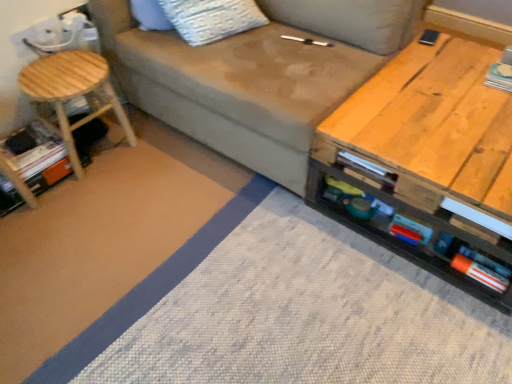
Question: Considering the relative sizes of wooden table at right and white paper book at upper right, which is counted as the 1th book, starting from the right, in the image provided, is wooden table at right thinner than white paper book at upper right, which is counted as the 1th book, starting from the right,?

Choices:
 (A) no
 (B) yes

Answer: (A)

Question: Is wooden table at right wider than white paper book at upper right, acting as the 1th book starting from the top?

Choices:
 (A) yes
 (B) no

Answer: (A)

Question: Is wooden table at right far away from white paper book at upper right, acting as the 1th book starting from the top?

Choices:
 (A) yes
 (B) no

Answer: (B)

Question: Are wooden table at right and white paper book at upper right, positioned as the 2th book in bottom-to-top order, beside each other?

Choices:
 (A) yes
 (B) no

Answer: (B)

Question: Considering the relative positions of wooden table at right and white paper book at upper right, which is counted as the 1th book, starting from the right, in the image provided, is wooden table at right to the right of white paper book at upper right, which is counted as the 1th book, starting from the right, from the viewer's perspective?

Choices:
 (A) yes
 (B) no

Answer: (B)

Question: In terms of width, does natural wood stool at left look wider or thinner when compared to wooden table at right?

Choices:
 (A) thin
 (B) wide

Answer: (A)

Question: From the image's perspective, is natural wood stool at left located above or below wooden table at right?

Choices:
 (A) above
 (B) below

Answer: (A)

Question: In terms of height, does natural wood stool at left look taller or shorter compared to wooden table at right?

Choices:
 (A) tall
 (B) short

Answer: (B)

Question: Is natural wood stool at left to the left or to the right of wooden table at right in the image?

Choices:
 (A) left
 (B) right

Answer: (A)

Question: Considering the positions of wooden table at right and natural wood stool at left in the image, is wooden table at right wider or thinner than natural wood stool at left?

Choices:
 (A) wide
 (B) thin

Answer: (A)

Question: From the image's perspective, is wooden table at right positioned above or below natural wood stool at left?

Choices:
 (A) above
 (B) below

Answer: (B)

Question: Considering the positions of wooden table at right and natural wood stool at left in the image, is wooden table at right taller or shorter than natural wood stool at left?

Choices:
 (A) tall
 (B) short

Answer: (A)

Question: Is wooden table at right bigger or smaller than natural wood stool at left?

Choices:
 (A) big
 (B) small

Answer: (A)

Question: Considering the positions of point (28, 152) and point (391, 44), is point (28, 152) closer or farther from the camera than point (391, 44)?

Choices:
 (A) farther
 (B) closer

Answer: (A)

Question: Is orange cardboard book at lower left, which is the second book from right to left, inside the boundaries of matte gray fabric couch at center, or outside?

Choices:
 (A) outside
 (B) inside

Answer: (A)